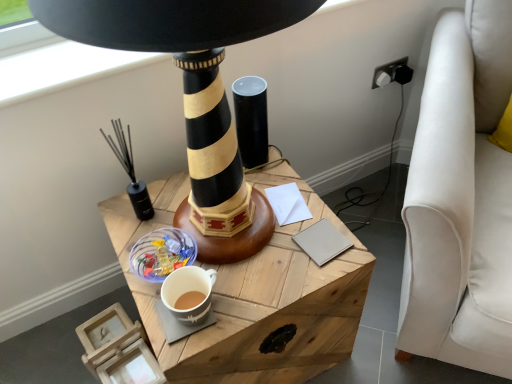
Where is `free space that is in between matte ceramic mug at lower center and beige leather notepad at center, placed as the 1th notepad when sorted from front to back`? The image size is (512, 384). free space that is in between matte ceramic mug at lower center and beige leather notepad at center, placed as the 1th notepad when sorted from front to back is located at coordinates (271, 270).